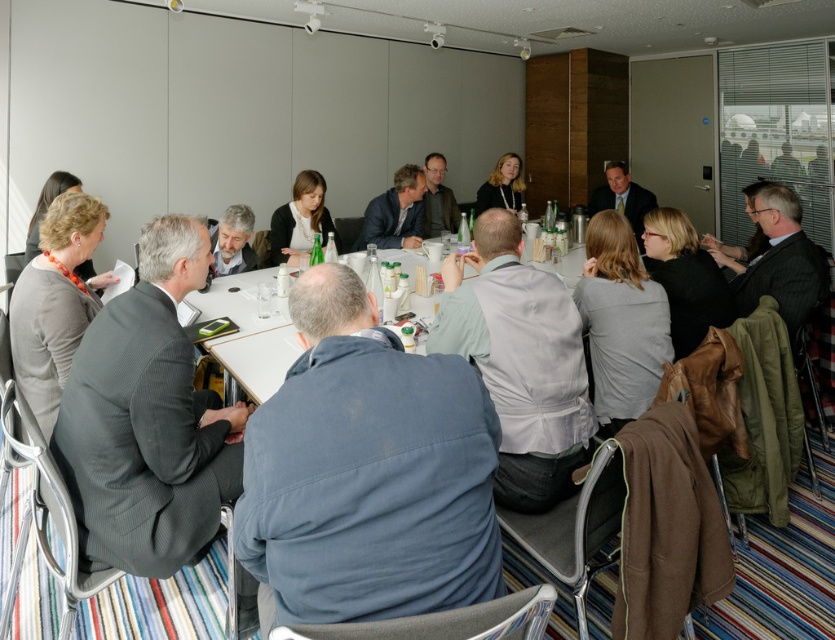
Question: Among these objects, which one is nearest to the camera?

Choices:
 (A) white glossy table at center
 (B) matte blue shirt at center
 (C) matte black jacket at upper center

Answer: (A)

Question: Is white glossy table at center closer to the viewer compared to matte black jacket at upper center?

Choices:
 (A) no
 (B) yes

Answer: (B)

Question: Can you confirm if matte black shirt at center is thinner than matte black jacket at upper center?

Choices:
 (A) yes
 (B) no

Answer: (A)

Question: Considering the real-world distances, which object is farthest from the matte black shirt at center?

Choices:
 (A) white glossy table at center
 (B) blue cotton shirt at center
 (C) matte blue shirt at center

Answer: (B)

Question: Which is farther from the matte blue shirt at center?

Choices:
 (A) blue cotton shirt at center
 (B) matte black jacket at upper center
 (C) matte black shirt at center
 (D) white glossy table at center

Answer: (A)

Question: Does blue cotton shirt at center come in front of matte blue shirt at center?

Choices:
 (A) yes
 (B) no

Answer: (A)